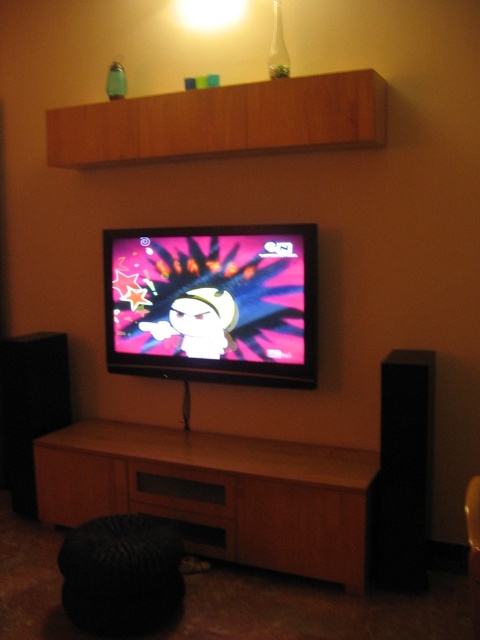
Question: Which object is the farthest from the black knitted stool at lower left?

Choices:
 (A) flat screen tv at center
 (B) black matte speaker at right
 (C) wooden cabinet at lower center

Answer: (B)

Question: Does black knitted stool at lower left come behind black matte speaker at right?

Choices:
 (A) yes
 (B) no

Answer: (B)

Question: Which object is the farthest from the black knitted stool at lower left?

Choices:
 (A) black matte speaker at left
 (B) wooden cabinet at lower center
 (C) black matte speaker at right
 (D) flat screen tv at center

Answer: (C)

Question: Does black knitted stool at lower left appear on the right side of black matte speaker at left?

Choices:
 (A) no
 (B) yes

Answer: (B)

Question: Based on their relative distances, which object is farther from the black matte speaker at right?

Choices:
 (A) black matte speaker at left
 (B) black knitted stool at lower left
 (C) flat screen tv at center
 (D) wooden cabinet at lower center

Answer: (A)

Question: Where is black knitted stool at lower left located in relation to black matte speaker at right in the image?

Choices:
 (A) right
 (B) left

Answer: (B)